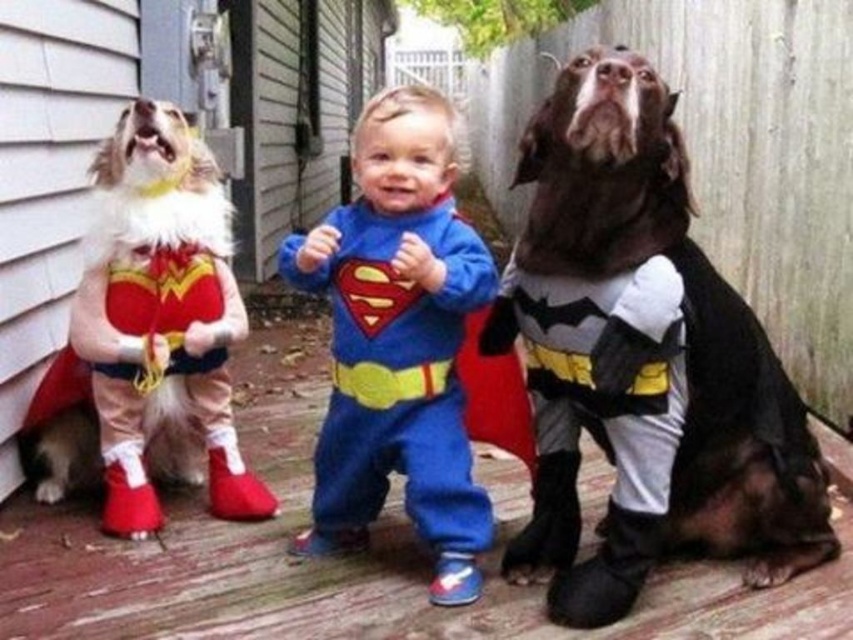
You are a photographer setting up for a superhero family photo. You need to ensure that the dark brown fur batman at center and the fuzzy white dog at left are both visible in the frame. Based on their sizes, which one might you need to position closer to the camera to keep them both in focus?

The dark brown fur batman at center is much taller than the fuzzy white dog at left, so positioning the fuzzy white dog at left closer to the camera would help keep both in focus by reducing the distance between them.